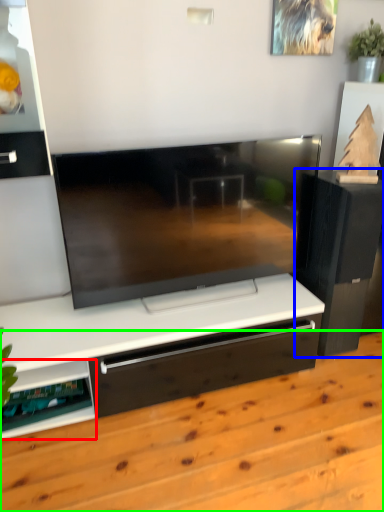
Question: Estimate the real-world distances between objects in this image. Which object is farther from shelf (highlighted by a red box), furniture (highlighted by a blue box) or hardwood (highlighted by a green box)?

Choices:
 (A) furniture
 (B) hardwood

Answer: (A)